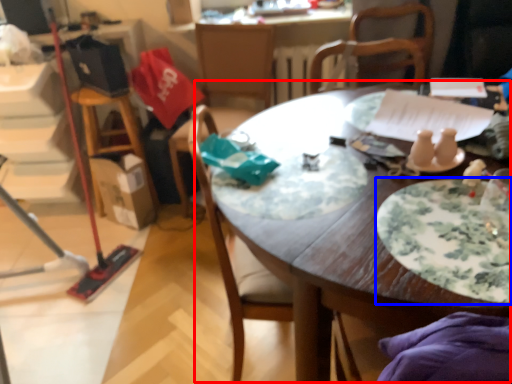
Question: Which object is further to the camera taking this photo, table (highlighted by a red box) or plate (highlighted by a blue box)?

Choices:
 (A) table
 (B) plate

Answer: (B)